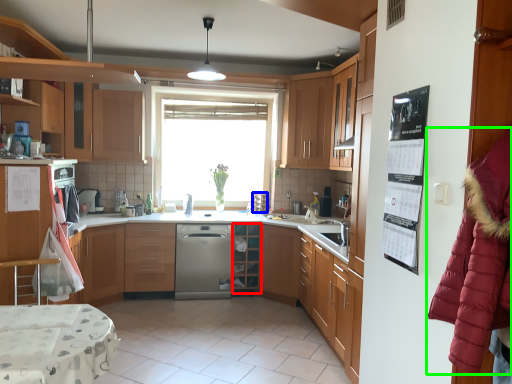
Question: Estimate the real-world distances between objects in this image. Which object is farther from shelf (highlighted by a red box), appliance (highlighted by a blue box) or fur coat (highlighted by a green box)?

Choices:
 (A) appliance
 (B) fur coat

Answer: (B)